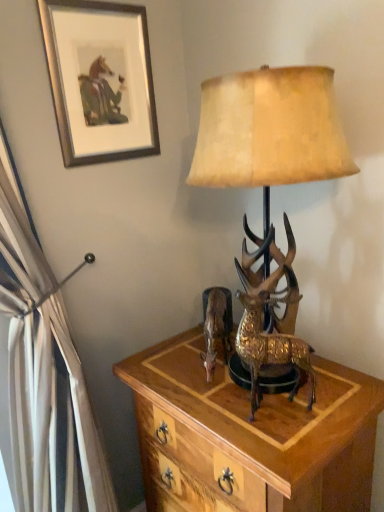
Question: Is gold textured deer at center at the left side of wooden nightstand at center?

Choices:
 (A) no
 (B) yes

Answer: (A)

Question: Can you confirm if gold textured deer at center is smaller than wooden nightstand at center?

Choices:
 (A) yes
 (B) no

Answer: (A)

Question: Can you confirm if gold textured deer at center is bigger than wooden nightstand at center?

Choices:
 (A) yes
 (B) no

Answer: (B)

Question: Can you confirm if gold textured deer at center is wider than wooden nightstand at center?

Choices:
 (A) no
 (B) yes

Answer: (A)

Question: From the image's perspective, is gold textured deer at center on top of wooden nightstand at center?

Choices:
 (A) yes
 (B) no

Answer: (A)

Question: Is gold textured deer at center located outside wooden nightstand at center?

Choices:
 (A) yes
 (B) no

Answer: (A)

Question: Does gold textured deer at center appear on the right side of gold textured deer at center?

Choices:
 (A) yes
 (B) no

Answer: (A)

Question: From the image's perspective, does gold textured deer at center appear higher than gold textured deer at center?

Choices:
 (A) no
 (B) yes

Answer: (B)

Question: From a real-world perspective, is gold textured deer at center below gold textured deer at center?

Choices:
 (A) yes
 (B) no

Answer: (B)

Question: Is gold textured deer at center aimed at gold textured deer at center?

Choices:
 (A) yes
 (B) no

Answer: (A)

Question: Is gold textured deer at center in contact with gold textured deer at center?

Choices:
 (A) no
 (B) yes

Answer: (A)

Question: Is the depth of gold textured deer at center greater than that of gold textured deer at center?

Choices:
 (A) no
 (B) yes

Answer: (A)

Question: Considering the relative sizes of metallic gold reindeer at center and gold textured deer at center in the image provided, is metallic gold reindeer at center wider than gold textured deer at center?

Choices:
 (A) yes
 (B) no

Answer: (A)